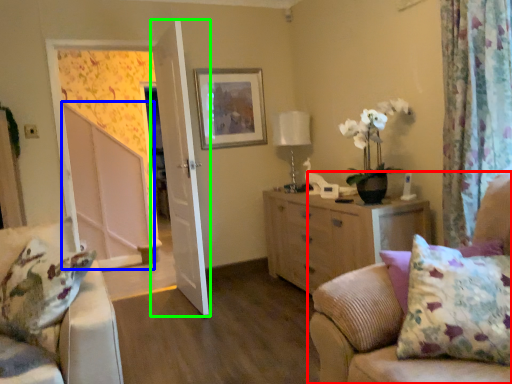
Question: Considering the real-world distances, which object is farthest from studio couch (highlighted by a red box)? screen door (highlighted by a blue box) or door (highlighted by a green box)?

Choices:
 (A) screen door
 (B) door

Answer: (A)